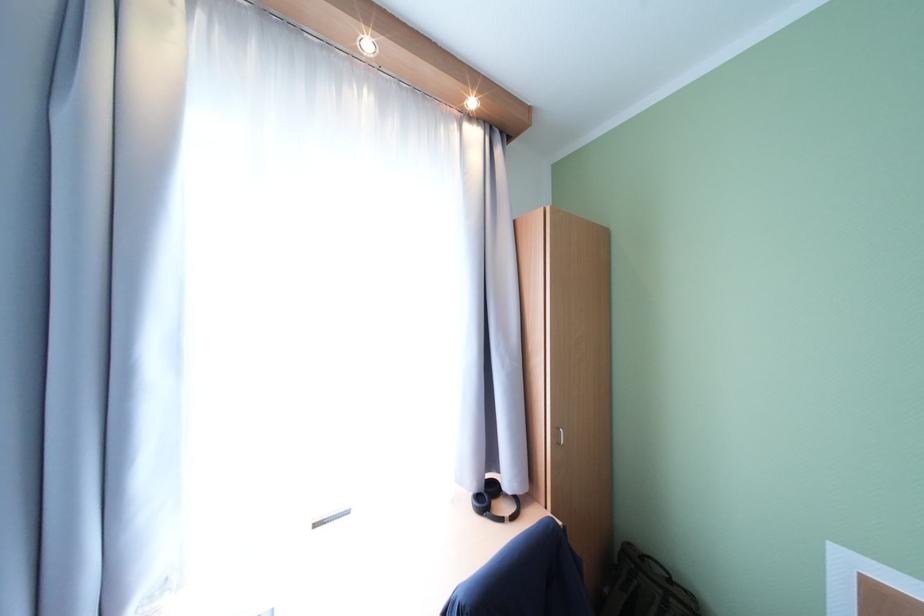
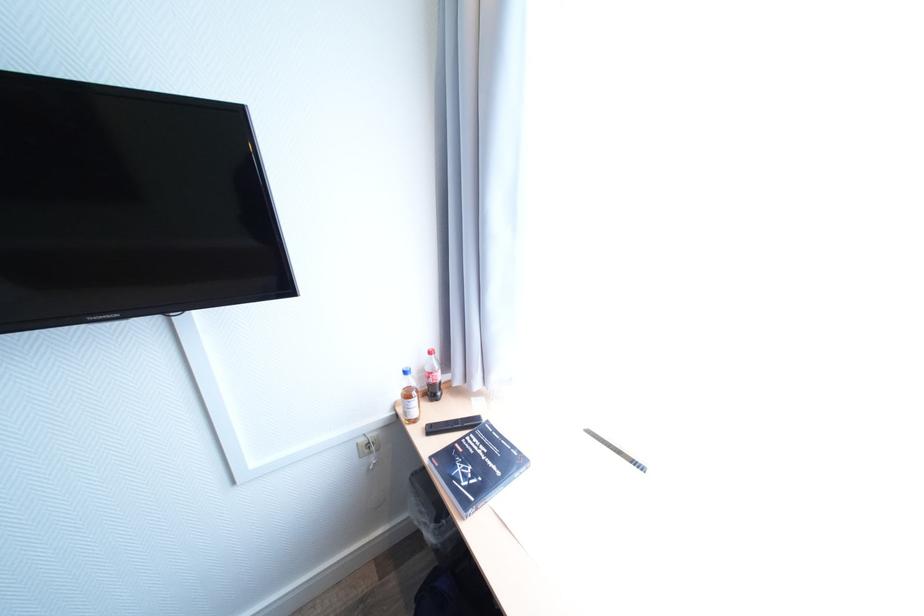
The first image is from the beginning of the video and the second image is from the end. How did the camera likely rotate when shooting the video?

The camera rotated toward left-down.